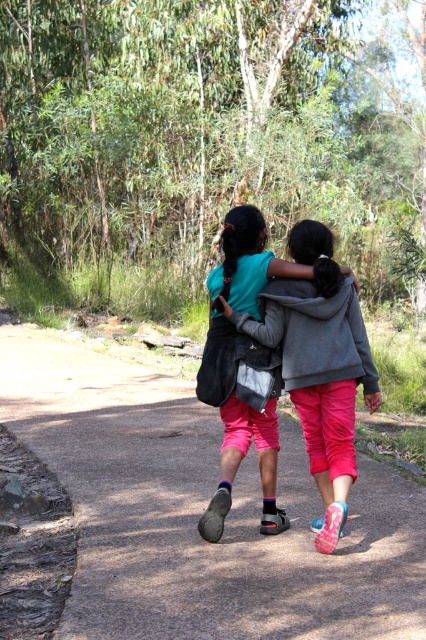
Does dirt path at center have a greater height compared to matte gray hoodie at center?

Incorrect, dirt path at center's height is not larger of matte gray hoodie at center's.

Who is shorter, dirt path at center or matte gray hoodie at center?

dirt path at center is shorter.

Is point (189, 406) positioned before point (296, 241)?

No, (189, 406) is further to viewer.

Locate an element on the screen. dirt path at center is located at coordinates (201, 513).